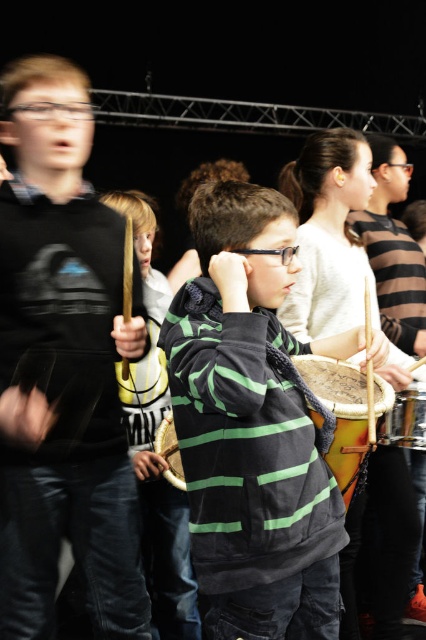
Which is behind, point (284, 348) or point (178, 452)?

Positioned behind is point (178, 452).

Does point (293, 248) come farther from viewer compared to point (166, 474)?

No, (293, 248) is in front of (166, 474).

This screenshot has width=426, height=640. What are the coordinates of `green striped hoodie at center` in the screenshot? It's located at (252, 428).

Image resolution: width=426 pixels, height=640 pixels. I want to click on green striped hoodie at center, so click(x=252, y=428).

Does matte black hoodie at left appear on the left side of shiny metallic drum at lower right?

Indeed, matte black hoodie at left is positioned on the left side of shiny metallic drum at lower right.

The image size is (426, 640). What are the coordinates of `matte black hoodie at left` in the screenshot? It's located at (63, 365).

The width and height of the screenshot is (426, 640). Identify the location of matte black hoodie at left. (63, 365).

Between point (385, 440) and point (172, 460), which one is positioned in front?

Point (385, 440) is in front.

Is shiny metallic drum at lower right bigger than wooden drum at center?

Correct, shiny metallic drum at lower right is larger in size than wooden drum at center.

Describe the element at coordinates (405, 419) in the screenshot. I see `shiny metallic drum at lower right` at that location.

What are the coordinates of `shiny metallic drum at lower right` in the screenshot? It's located at (405, 419).